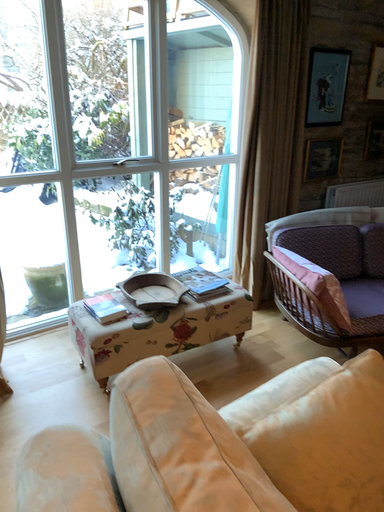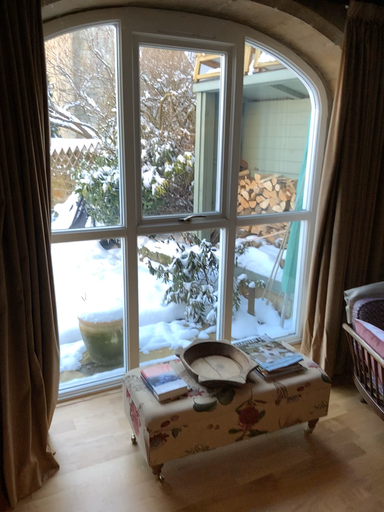
Question: Which way did the camera rotate in the video?

Choices:
 (A) rotated right
 (B) rotated left

Answer: (B)